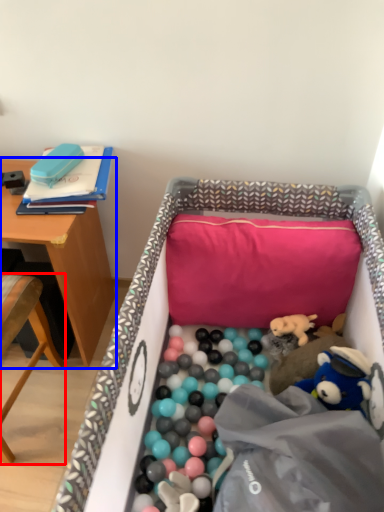
Question: Which object appears closest to the camera in this image, chair (highlighted by a red box) or table (highlighted by a blue box)?

Choices:
 (A) chair
 (B) table

Answer: (A)